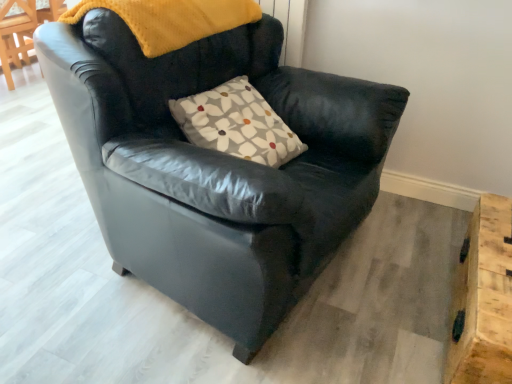
Question: Considering the positions of black leather armchair at center and wooden at lower right in the image, is black leather armchair at center taller or shorter than wooden at lower right?

Choices:
 (A) short
 (B) tall

Answer: (B)

Question: Considering the positions of point (108, 107) and point (465, 246), is point (108, 107) closer or farther from the camera than point (465, 246)?

Choices:
 (A) farther
 (B) closer

Answer: (B)

Question: Considering the real-world distances, which object is closest to the black leather armchair at center?

Choices:
 (A) wooden at lower right
 (B) floral-patterned fabric pillow at center

Answer: (B)

Question: Which object is the closest to the black leather armchair at center?

Choices:
 (A) floral-patterned fabric pillow at center
 (B) wooden at lower right

Answer: (A)